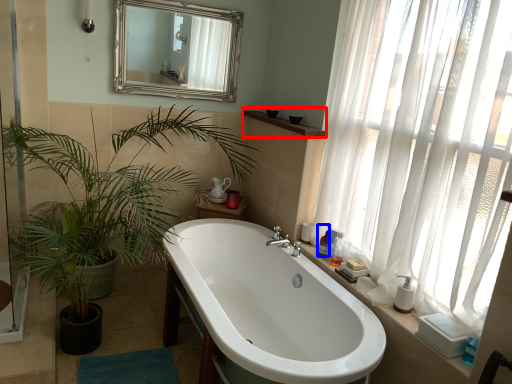
Question: Which of the following is the closest to the observer, window sill (highlighted by a red box) or toiletry (highlighted by a blue box)?

Choices:
 (A) window sill
 (B) toiletry

Answer: (B)